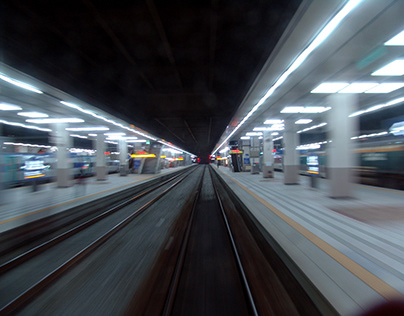
The height and width of the screenshot is (316, 404). What are the coordinates of `staircase` in the screenshot? It's located at (149, 166).